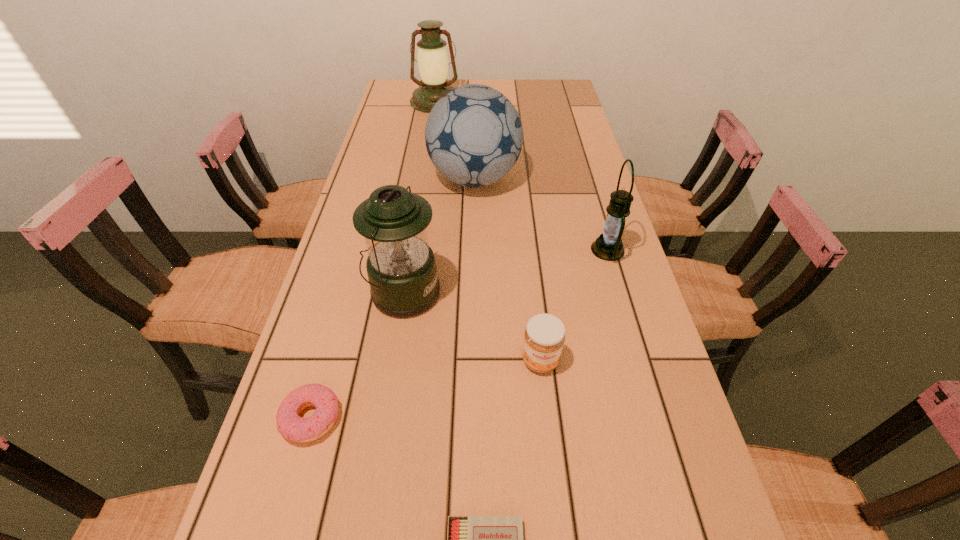
Find the location of `the farthest lantern`. the farthest lantern is located at coordinates (432, 58).

The image size is (960, 540). What are the coordinates of `the second farthest object` in the screenshot? It's located at (474, 135).

Locate an element on the screen. the fourth farthest object is located at coordinates (401, 267).

Find the location of a particular element. The width and height of the screenshot is (960, 540). the rightmost object is located at coordinates (608, 246).

Identify the location of the rightmost lantern. The image size is (960, 540). (608, 246).

The image size is (960, 540). Find the location of `the third nearest object`. the third nearest object is located at coordinates (544, 337).

Image resolution: width=960 pixels, height=540 pixels. I want to click on the third shortest object, so click(x=544, y=337).

The width and height of the screenshot is (960, 540). In order to click on the second shortest object in this screenshot , I will do `click(292, 427)`.

At what (x,y) coordinates should I click in order to perform the action: click on the sixth farthest object. Please return your answer as a coordinate pair (x, y). Image resolution: width=960 pixels, height=540 pixels. Looking at the image, I should click on (292, 427).

Locate an element on the screen. The height and width of the screenshot is (540, 960). vacant space located 0.370m with the light compartment facing forward on the farthest object is located at coordinates (425, 168).